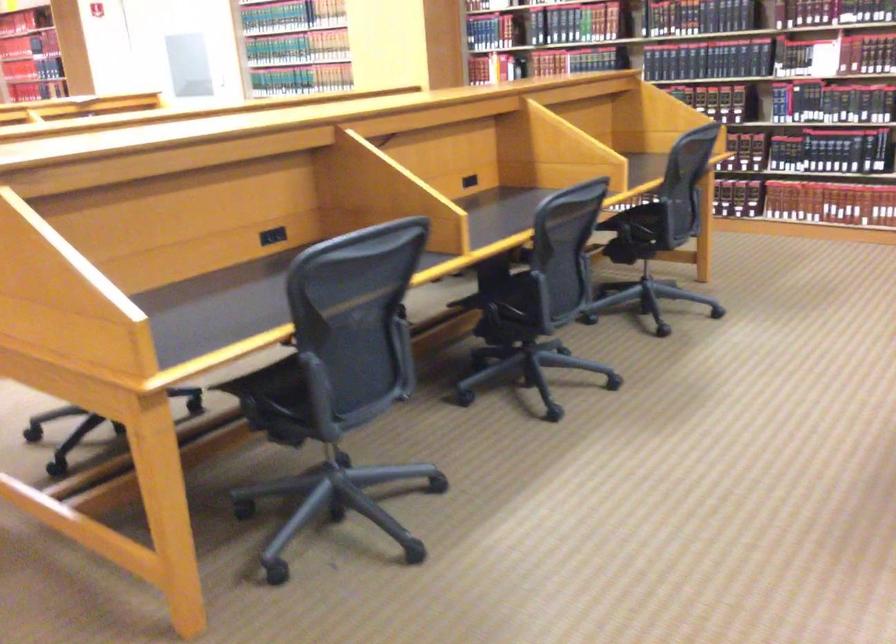
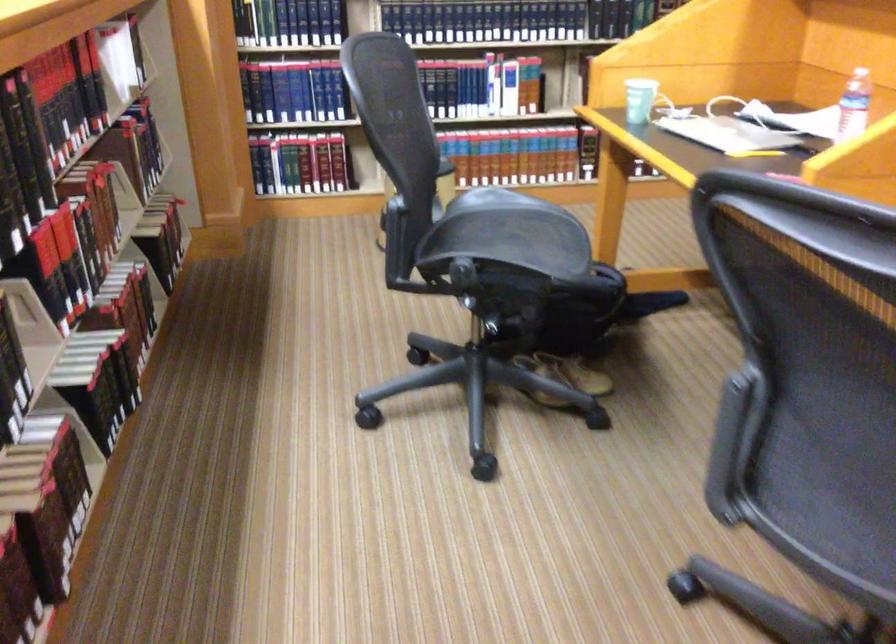
Question: I am providing you with two images of the same scene from different viewpoints. After the viewpoint changes to image2, which objects are now occluded?

Choices:
 (A) chair armrest
 (B) chair sitting surface
 (C) toy gun handle
 (D) plastic water bottle

Answer: (A)